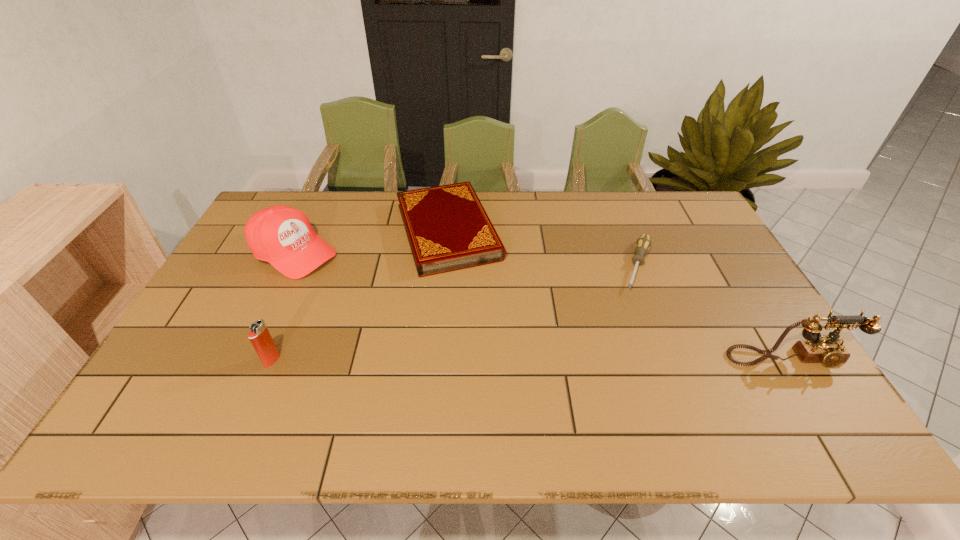
Where is `vacant space on the desktop that is between the igniter and the telephone and is positioned on the cover of the hardback book`? This screenshot has height=540, width=960. vacant space on the desktop that is between the igniter and the telephone and is positioned on the cover of the hardback book is located at coordinates (499, 359).

Identify the location of free spot on the desktop that is between the igniter and the telephone and is positioned at the tip of the second object from right to left. This screenshot has width=960, height=540. (609, 359).

Find the location of a particular element. This screenshot has height=540, width=960. vacant space on the desktop that is between the igniter and the rightmost object and is positioned on the front panel of the baseball cap is located at coordinates (472, 360).